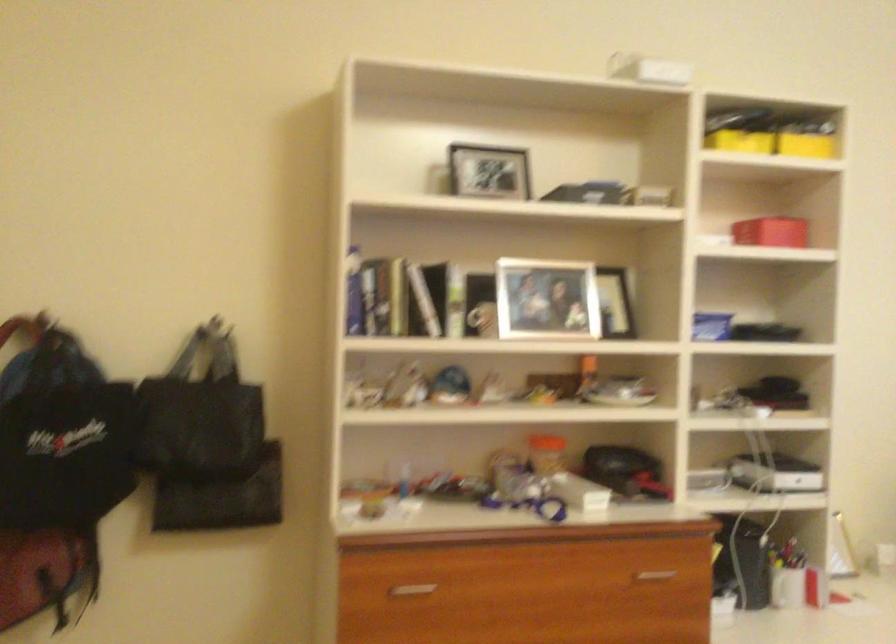
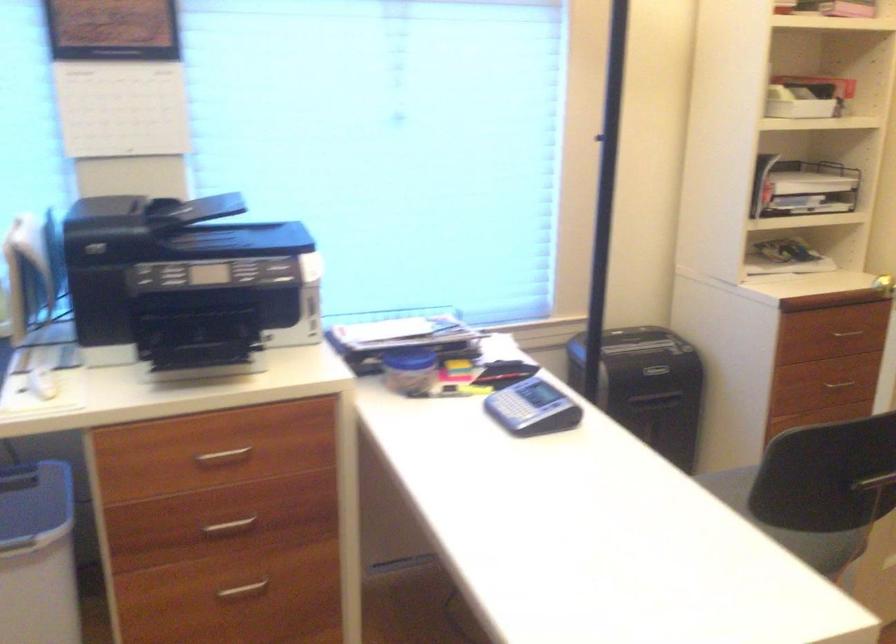
First-person continuous shooting, in which direction is the camera rotating?

The camera rotated toward right-down.